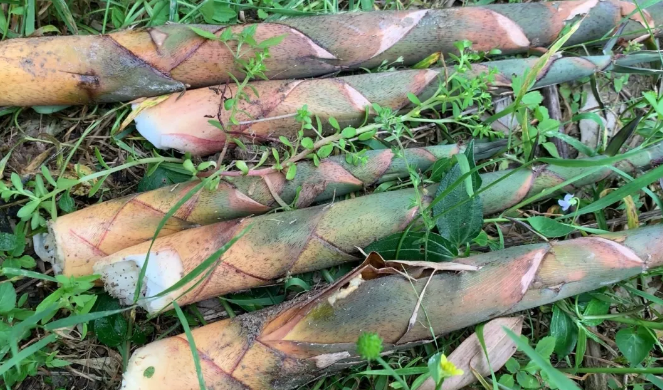
Identify the location of sort of plant. This screenshot has height=390, width=663. (385, 296), (311, 238), (278, 184), (311, 94), (288, 49).